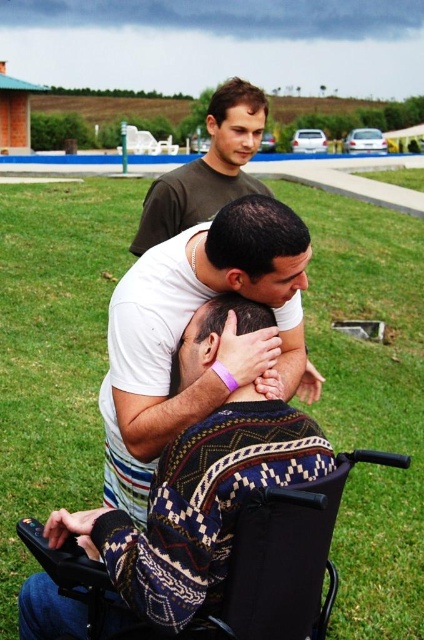
Question: Is knitted sweater at center to the left of matte brown shirt at upper center from the viewer's perspective?

Choices:
 (A) yes
 (B) no

Answer: (B)

Question: Can you confirm if knitted sweater at center is positioned above matte brown shirt at upper center?

Choices:
 (A) no
 (B) yes

Answer: (A)

Question: Which object appears closest to the camera in this image?

Choices:
 (A) knitted sweater at center
 (B) matte brown shirt at upper center

Answer: (A)

Question: Is knitted sweater at center bigger than black plastic wheelchair at lower left?

Choices:
 (A) no
 (B) yes

Answer: (B)

Question: Based on their relative distances, which object is farther from the black plastic wheelchair at lower left?

Choices:
 (A) white soft t-shirt at center
 (B) matte brown shirt at upper center

Answer: (B)

Question: Which point is closer to the camera?

Choices:
 (A) (155, 422)
 (B) (153, 225)
 (C) (315, 500)

Answer: (C)